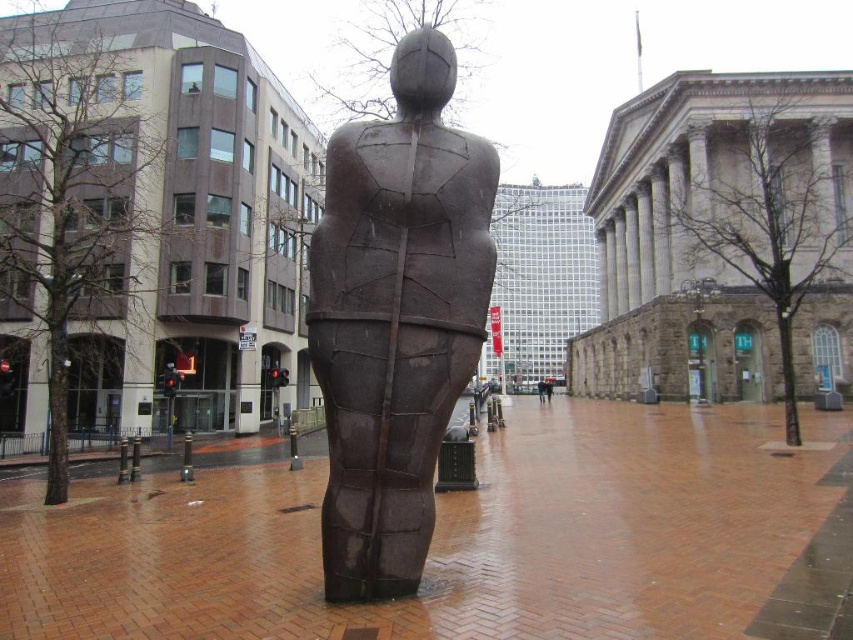
You are an art student standing in front of the bronze textured sculpture at center and the brown matte statue at center. Which one do you need to walk towards to get a closer look at the reflective wet bricks underneath?

The bronze textured sculpture at center is closer to the viewer than the brown matte statue at center, so you should walk towards the bronze textured sculpture at center to get a closer look at the reflective wet bricks underneath.

Based on the photo, you are an urban planner assessing the plaza layout. The bronze textured sculpture at center and the brown matte statue at center are both candidates for installation. Given their sizes, which one would require a smaller area to place?

The bronze textured sculpture at center occupies less space than the brown matte statue at center, so it would require a smaller area to place.